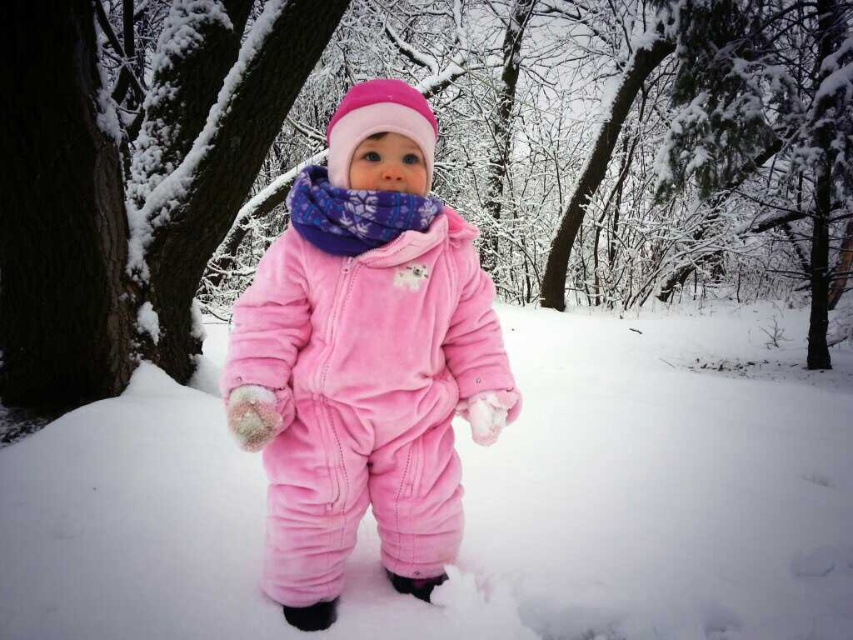
Question: Can you confirm if velvety pink snowsuit at center is positioned to the right of velvet pink snowsuit at center?

Choices:
 (A) no
 (B) yes

Answer: (A)

Question: Which of the following is the farthest from the observer?

Choices:
 (A) (344, 244)
 (B) (3, 365)

Answer: (B)

Question: Which of the following is the closest to the observer?

Choices:
 (A) snow-covered bark tree at left
 (B) smooth bark tree at center
 (C) velvety pink snowsuit at center

Answer: (B)

Question: Which point is farther to the camera?

Choices:
 (A) (234, 132)
 (B) (378, 330)

Answer: (A)

Question: Is the position of velvety pink snowsuit at center less distant than that of snow-covered bark tree at left?

Choices:
 (A) no
 (B) yes

Answer: (B)

Question: Does velvety pink snowsuit at center have a smaller size compared to velvet pink snowsuit at center?

Choices:
 (A) no
 (B) yes

Answer: (B)